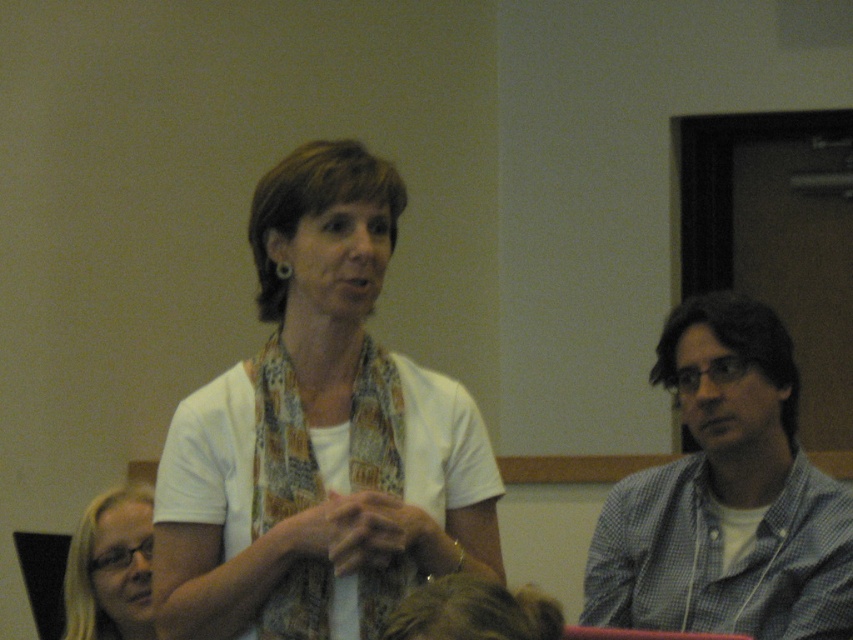
You are attending a meeting and need to pass a note to the person wearing the checkered fabric shirt at right. Based on their position, which direction should you move to reach them?

The checkered fabric shirt at right is located at point (726, 497), so you should move towards the right side of the frame to reach them.

You are an interior designer assessing the layout of this meeting space. The checkered fabric shirt at right and the matte black glasses at lower left are part of the scene. Which object occupies more vertical space in the image?

The checkered fabric shirt at right has a greater height compared to the matte black glasses at lower left, so it occupies more vertical space in the image.

You are an interior designer analyzing the spatial arrangement of the meeting scene. Based on the positions of the white matte scarf at center and the checkered fabric shirt at right, can you determine which object is higher in the image?

The white matte scarf at center is above the checkered fabric shirt at right, so it is higher in the image.